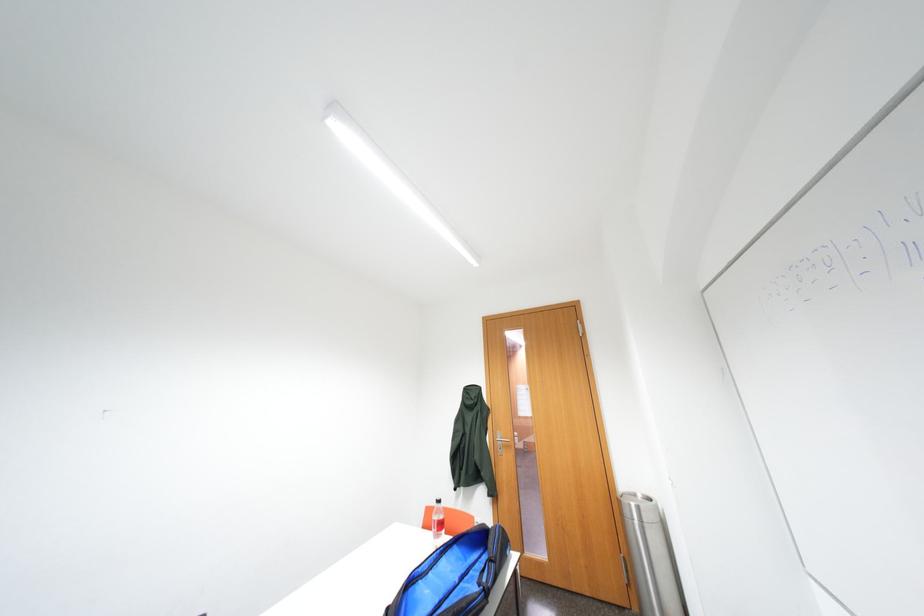
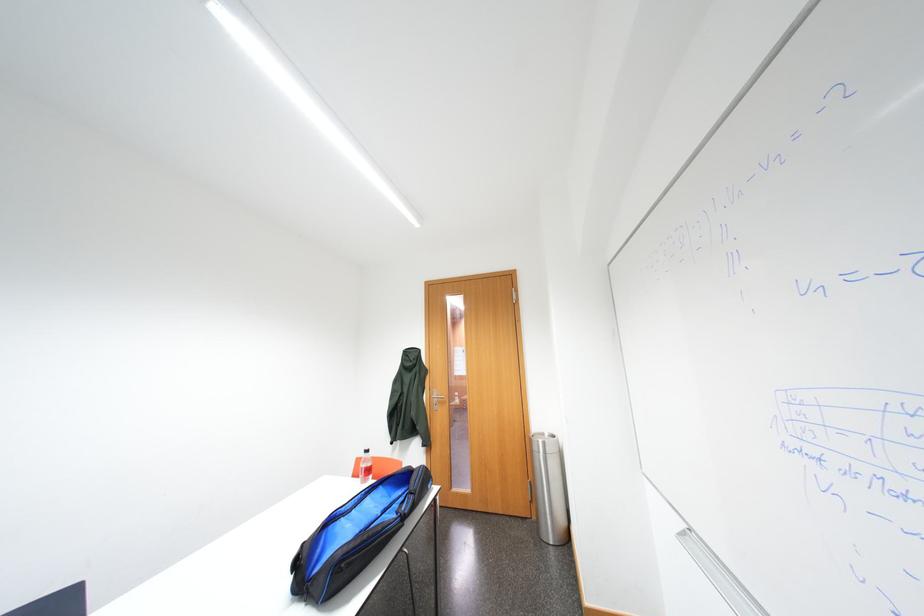
Question: How did the camera likely rotate?

Choices:
 (A) Left
 (B) Right
 (C) Up
 (D) Down

Answer: (B)